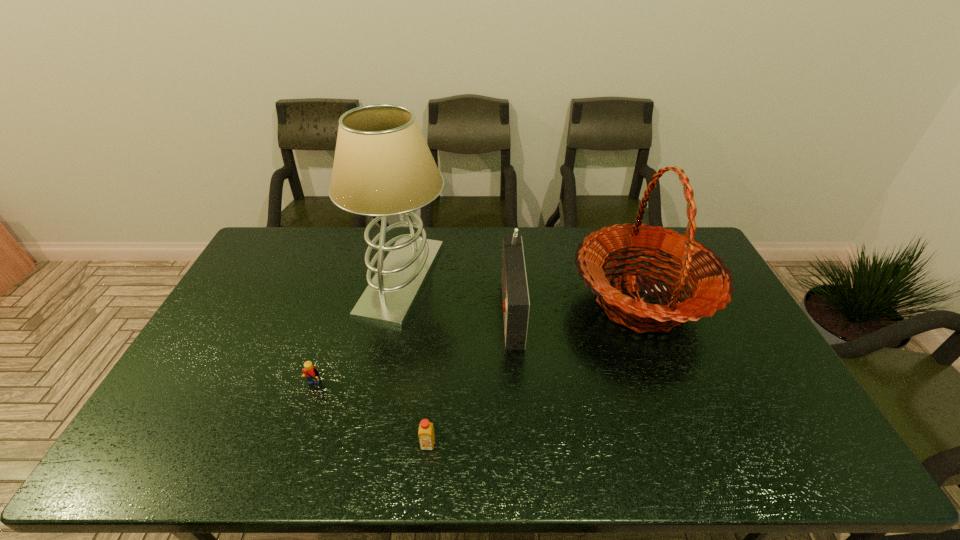
Locate an element on the screen. free space located on the left of the fourth shortest object is located at coordinates (502, 302).

Identify the location of free space located on the front panel of the second object from right to left. (466, 308).

You are a GUI agent. You are given a task and a screenshot of the screen. Output one action in this format:
    pyautogui.click(x=<x>, y=<y>)
    Task: Click on the vacant space situated 0.160m on the front panel of the second object from right to left
    
    Given the screenshot: What is the action you would take?
    pyautogui.click(x=450, y=308)

Locate an element on the screen. vacant area located on the front panel of the second object from right to left is located at coordinates (438, 308).

Find the location of `vacant space located on the front-facing side of the second shortest object`. vacant space located on the front-facing side of the second shortest object is located at coordinates tap(301, 423).

At what (x,y) coordinates should I click in order to perform the action: click on table lamp at the far edge. Please return your answer as a coordinate pair (x, y). Looking at the image, I should click on click(383, 167).

Locate an element on the screen. basket that is positioned at the far edge is located at coordinates (712, 282).

The height and width of the screenshot is (540, 960). Identify the location of object situated at the near edge. (426, 435).

Locate an element on the screen. This screenshot has height=540, width=960. object present at the right edge is located at coordinates (712, 282).

The image size is (960, 540). Find the location of `object at the far right corner`. object at the far right corner is located at coordinates (712, 282).